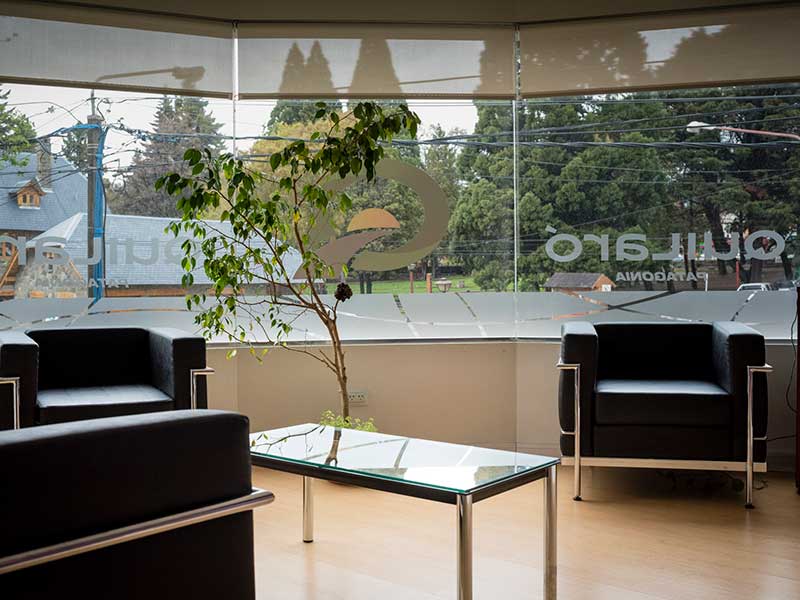
You are a GUI agent. You are given a task and a screenshot of the screen. Output one action in this format:
    pyautogui.click(x=<x>, y=<y>)
    Task: Click on the floor
    
    Given the screenshot: What is the action you would take?
    pyautogui.click(x=685, y=542)